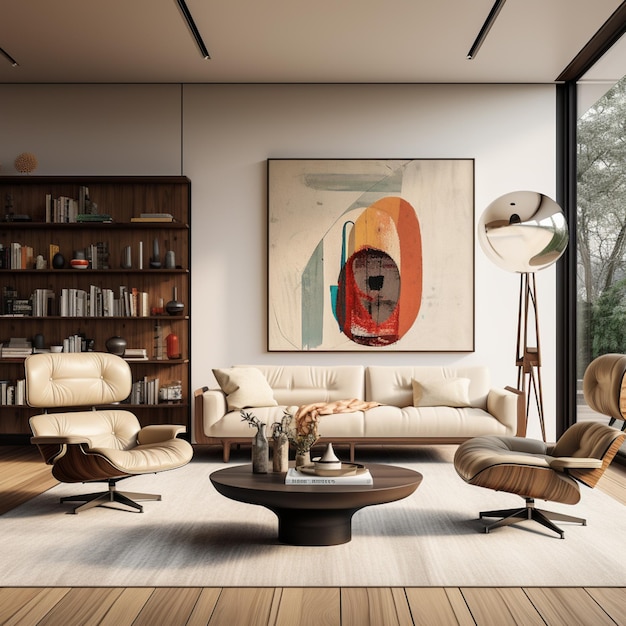
Where is `window`? Image resolution: width=626 pixels, height=626 pixels. window is located at coordinates (582, 299).